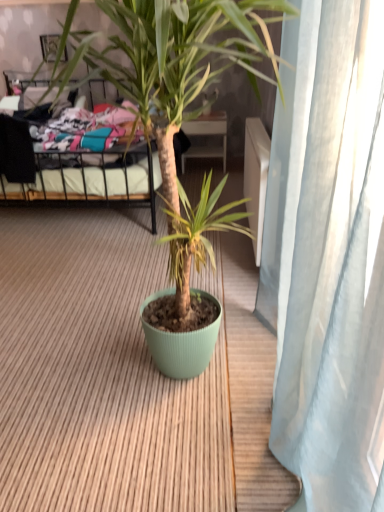
Question: From a real-world perspective, is metallic black bed at upper left beneath matte black picture frame at upper left?

Choices:
 (A) yes
 (B) no

Answer: (A)

Question: Does metallic black bed at upper left have a smaller size compared to matte black picture frame at upper left?

Choices:
 (A) yes
 (B) no

Answer: (B)

Question: From the image's perspective, does metallic black bed at upper left appear lower than matte black picture frame at upper left?

Choices:
 (A) no
 (B) yes

Answer: (B)

Question: Does metallic black bed at upper left appear on the right side of matte black picture frame at upper left?

Choices:
 (A) no
 (B) yes

Answer: (B)

Question: Is matte black picture frame at upper left completely or partially inside metallic black bed at upper left?

Choices:
 (A) yes
 (B) no

Answer: (B)

Question: Is metallic black bed at upper left positioned with its back to matte black picture frame at upper left?

Choices:
 (A) no
 (B) yes

Answer: (A)

Question: Does matte green pot at center have a smaller size compared to matte black picture frame at upper left?

Choices:
 (A) no
 (B) yes

Answer: (A)

Question: Is matte green pot at center at the left side of matte black picture frame at upper left?

Choices:
 (A) no
 (B) yes

Answer: (A)

Question: Is matte green pot at center positioned in front of matte black picture frame at upper left?

Choices:
 (A) no
 (B) yes

Answer: (B)

Question: From the image's perspective, would you say matte green pot at center is positioned over matte black picture frame at upper left?

Choices:
 (A) yes
 (B) no

Answer: (B)

Question: Is matte green pot at center not near matte black picture frame at upper left?

Choices:
 (A) no
 (B) yes

Answer: (B)

Question: Is matte green pot at center with matte black picture frame at upper left?

Choices:
 (A) yes
 (B) no

Answer: (B)

Question: From the image's perspective, is metallic black bed at upper left above matte green pot at center?

Choices:
 (A) no
 (B) yes

Answer: (B)